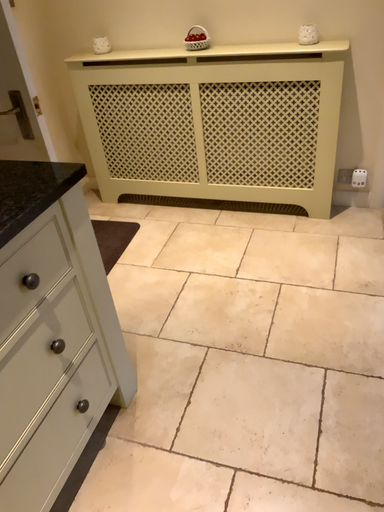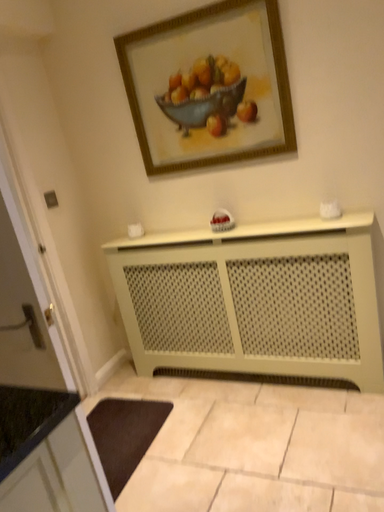
Question: How did the camera likely rotate when shooting the video?

Choices:
 (A) rotated upward
 (B) rotated downward

Answer: (A)